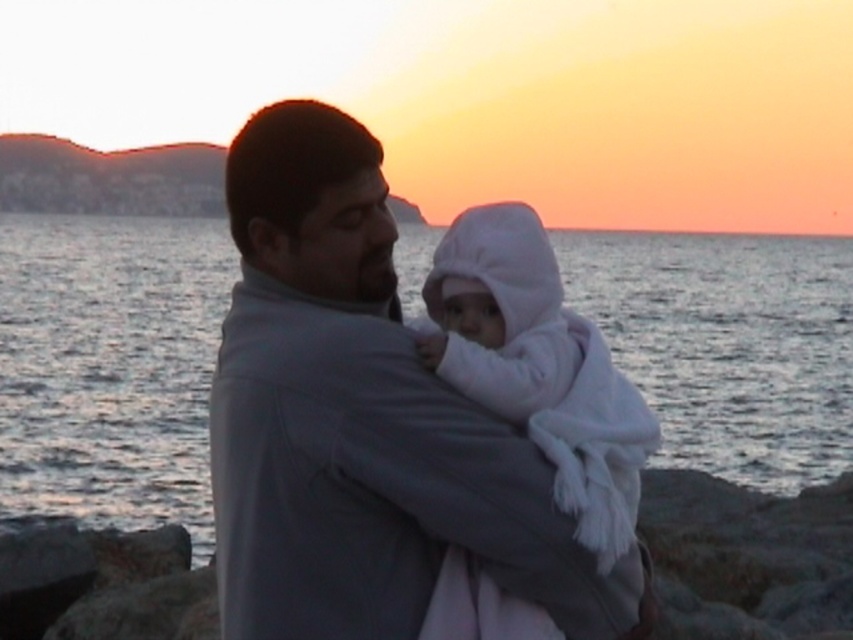
Question: Is gray fabric jacket at center thinner than white fleece baby at center?

Choices:
 (A) yes
 (B) no

Answer: (B)

Question: Does silvery water at center appear on the right side of white fleece baby at center?

Choices:
 (A) no
 (B) yes

Answer: (B)

Question: Which point appears closest to the camera in this image?

Choices:
 (A) (260, 225)
 (B) (521, 365)
 (C) (190, 468)

Answer: (B)

Question: Among these objects, which one is farthest from the camera?

Choices:
 (A) white fleece baby at center
 (B) silvery water at center

Answer: (B)

Question: Can you confirm if silvery water at center is smaller than gray fabric jacket at center?

Choices:
 (A) no
 (B) yes

Answer: (A)

Question: Which point is farther to the camera?

Choices:
 (A) (128, 452)
 (B) (276, 301)

Answer: (A)